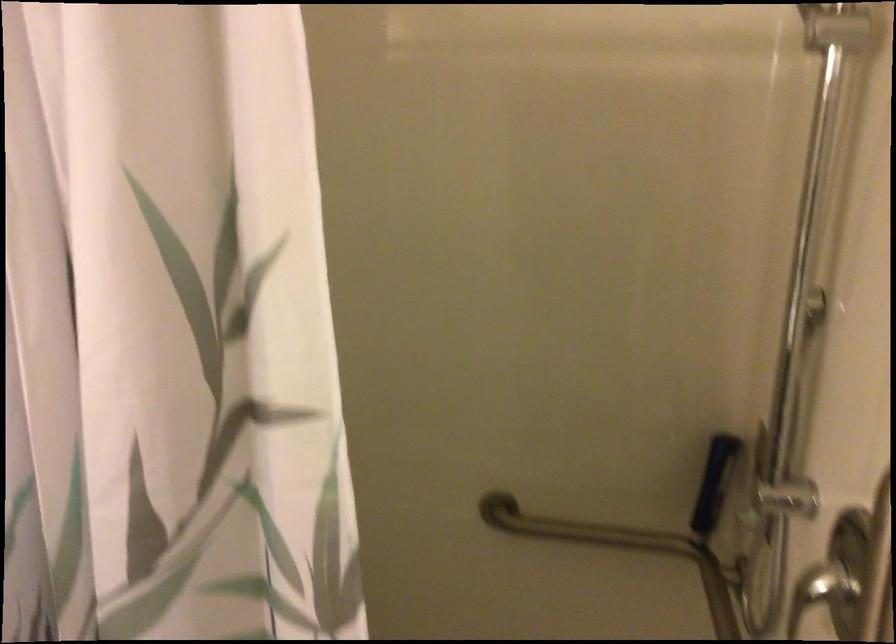
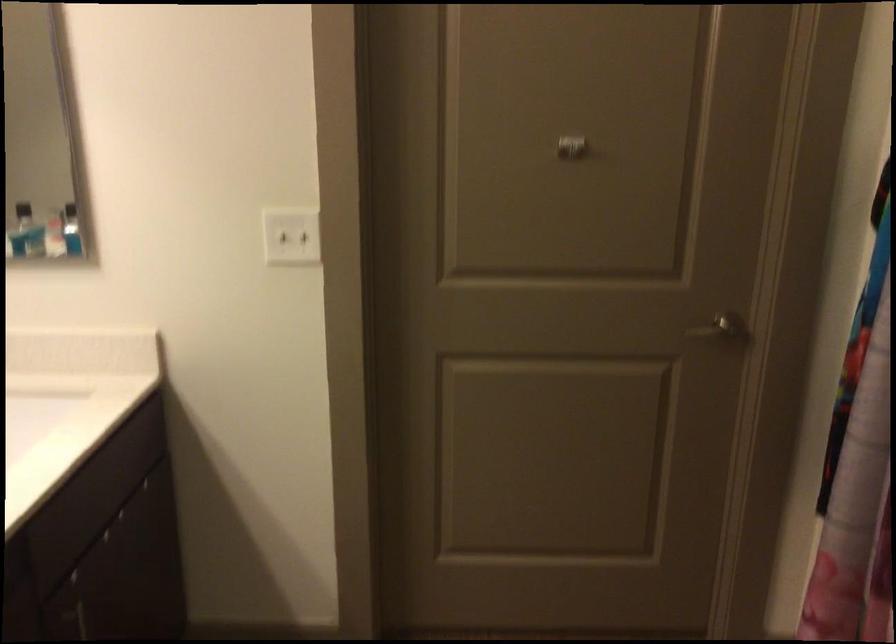
The first image is from the beginning of the video and the second image is from the end. How did the camera likely rotate when shooting the video?

The camera's rotation is toward left-down.